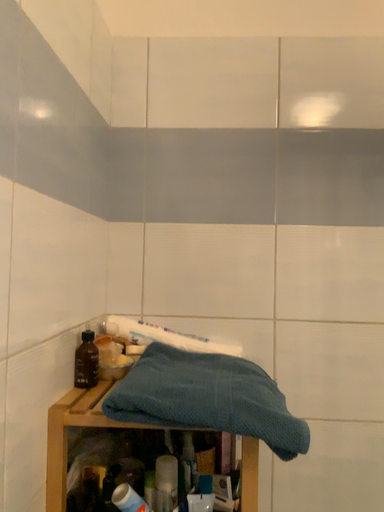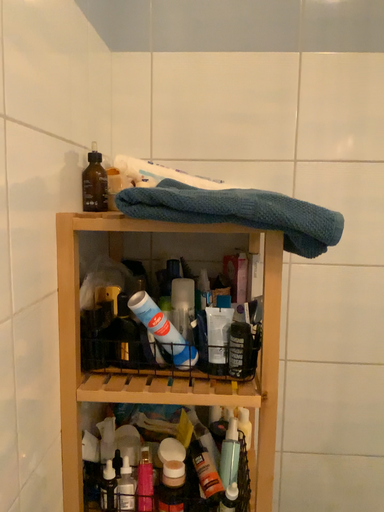
Question: How did the camera likely rotate when shooting the video?

Choices:
 (A) rotated upward
 (B) rotated downward

Answer: (B)